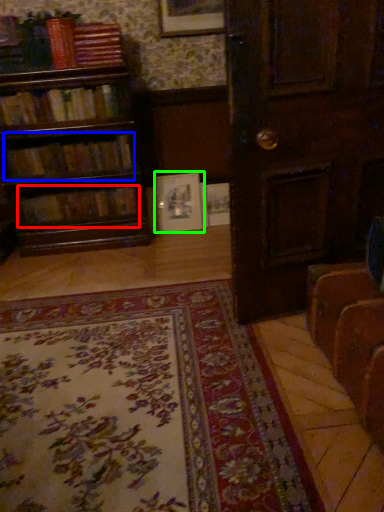
Question: Which object is positioned farthest from book (highlighted by a red box)? Select from book (highlighted by a blue box) and picture frame (highlighted by a green box).

Choices:
 (A) book
 (B) picture frame

Answer: (B)